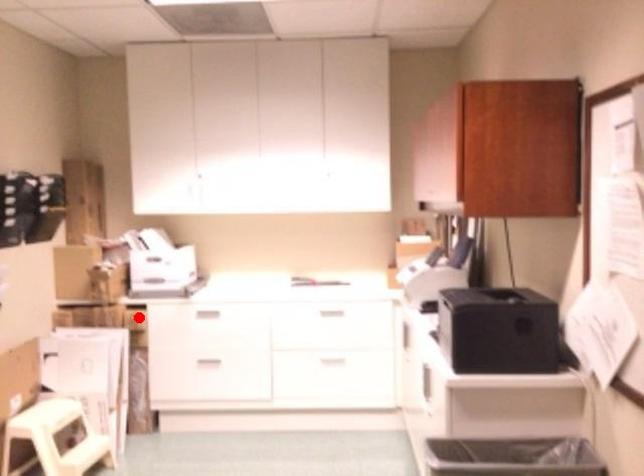
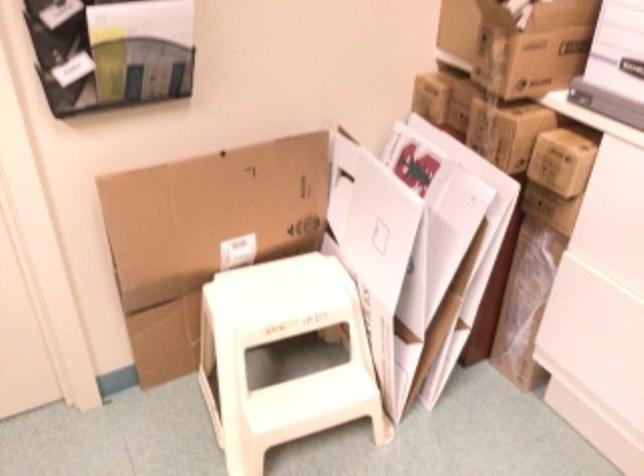
Locate, in the second image, the point that corresponds to the highlighted location in the first image.

(562, 160)